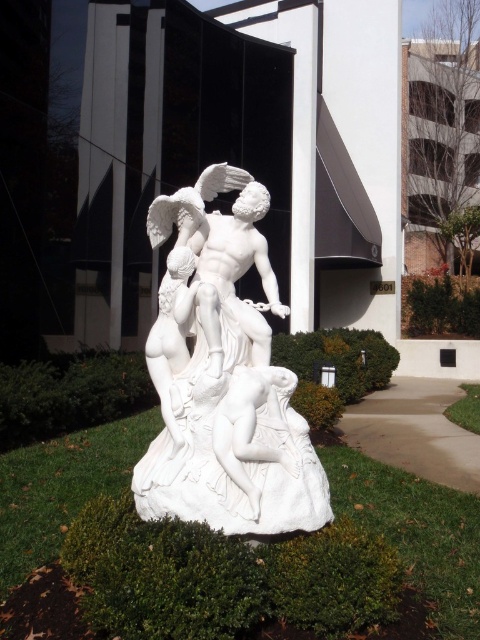
You are an art student who wants to sketch the scene. You need to know the relative positions of the white marble sculpture at center and the white marble nude at lower center. Which one is higher up in the image?

The white marble sculpture at center is located above the white marble nude at lower center, so the white marble sculpture at center is higher up in the image.

You are an art student who wants to sketch the white marble sculpture at center. You are standing at the point with coordinates point [223,378]. Can you see the entire sculpture from this position?

The point [223,378] indicates white marble sculpture at center, so yes, you are standing right at the sculpture. Therefore, you can see the entire sculpture from this position.